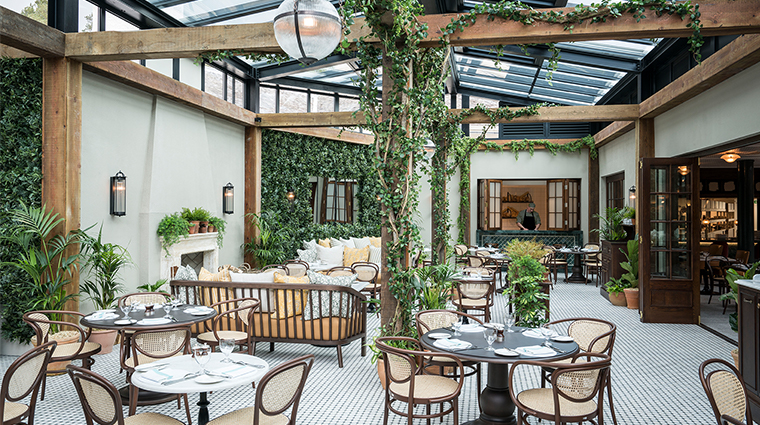
Find the location of a particular element. The image size is (760, 425). door is located at coordinates (670, 260).